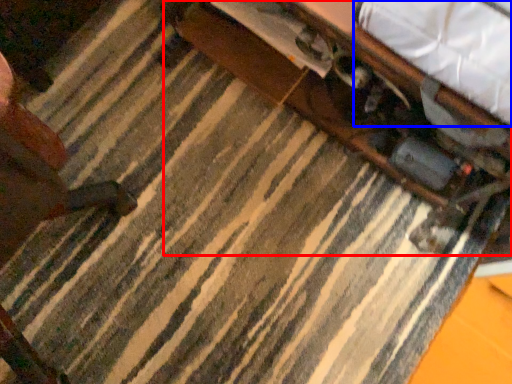
Question: Among these objects, which one is farthest to the camera, table (highlighted by a red box) or sheet (highlighted by a blue box)?

Choices:
 (A) table
 (B) sheet

Answer: (A)